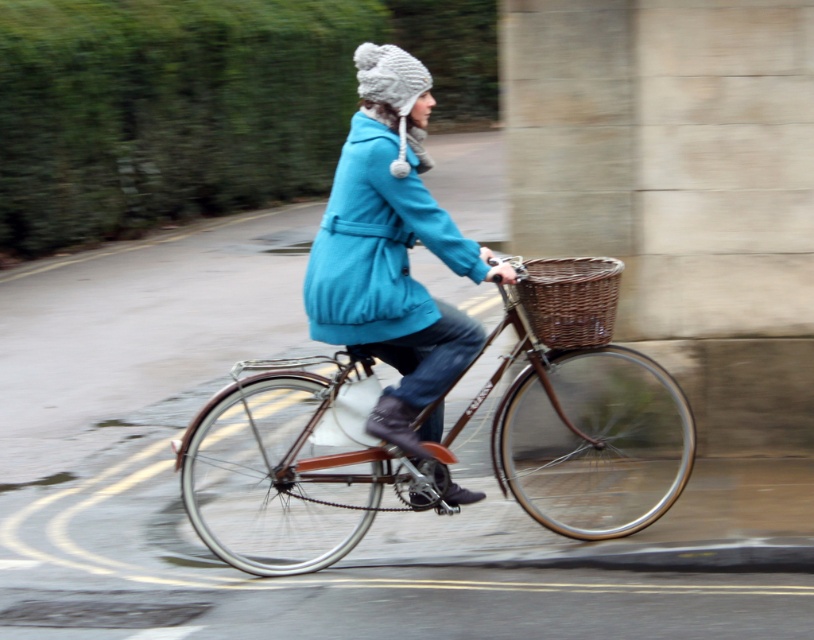
Based on the photo, you are a delivery person who needs to place a small package in the closest object to you between the brown wicker basket at center and the matte blue coat at center. Which object should you choose?

The brown wicker basket at center is closer to the viewer than the matte blue coat at center, so you should place the package in the brown wicker basket at center.

Based on the photo, you are a delivery drone trying to avoid the turquoise wool coat at center. What direction should you fly to stay clear of it?

The turquoise wool coat at center is located at point (x=392, y=252). To avoid it, fly in a direction away from these coordinates, such as towards the edges of the scene.

You are a pedestrian standing on the sidewalk observing the cyclist. Which object is closer to the ground, the brown wicker basket at center or the matte blue coat at center?

The brown wicker basket at center is closer to the ground because it is located below the matte blue coat at center.